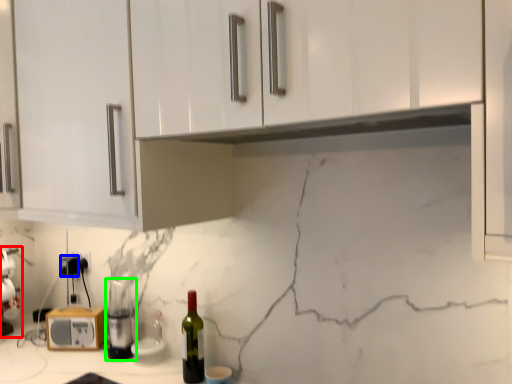
Question: Considering the real-world distances, which object is farthest from blender (highlighted by a red box)? electric outlet (highlighted by a blue box) or appliance (highlighted by a green box)?

Choices:
 (A) electric outlet
 (B) appliance

Answer: (B)